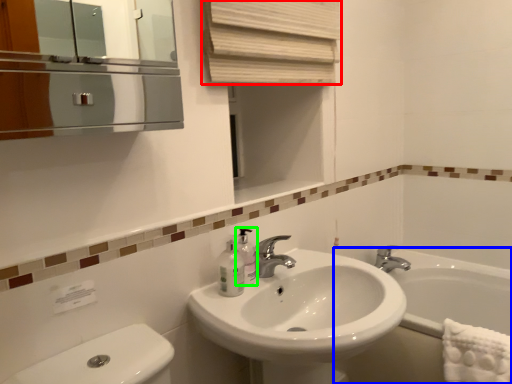
Question: Estimate the real-world distances between objects in this image. Which object is farther from curtain (highlighted by a red box), bath (highlighted by a blue box) or soap dispenser (highlighted by a green box)?

Choices:
 (A) bath
 (B) soap dispenser

Answer: (A)